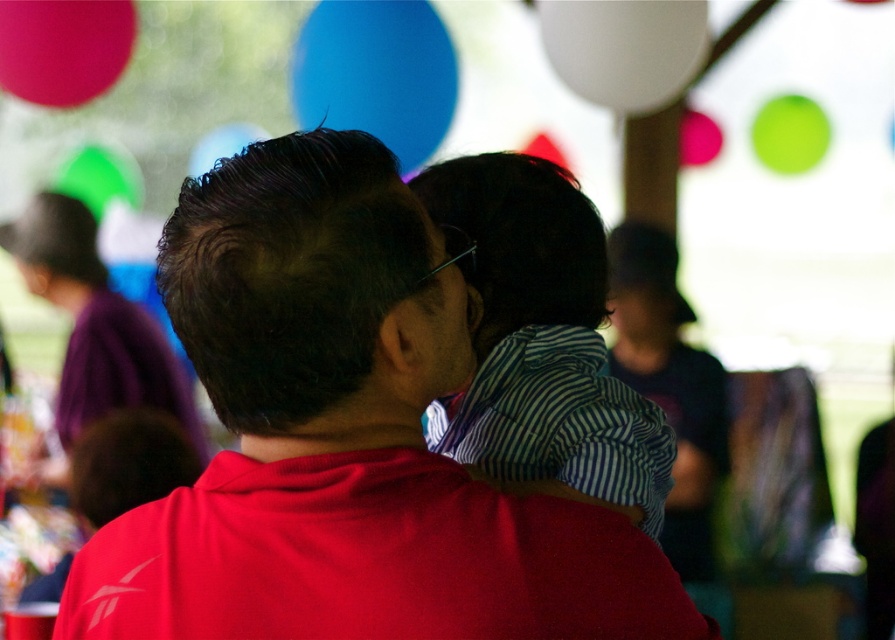
Question: Does white matte balloon at upper center appear on the left side of matte pink balloon at upper right?

Choices:
 (A) yes
 (B) no

Answer: (A)

Question: Among these objects, which one is farthest from the camera?

Choices:
 (A) green matte balloon at upper right
 (B) purple fabric at upper left
 (C) striped fabric shirt at center

Answer: (A)

Question: Where is purple fabric at upper left located in relation to matte pink balloon at upper right in the image?

Choices:
 (A) above
 (B) below

Answer: (B)

Question: Is green matte balloon at upper left further to camera compared to matte pink balloon at upper right?

Choices:
 (A) yes
 (B) no

Answer: (A)

Question: Among these points, which one is farthest from the camera?

Choices:
 (A) (11, 51)
 (B) (61, 173)
 (C) (355, 161)

Answer: (B)

Question: Which point appears farthest from the camera in this image?

Choices:
 (A) (558, 323)
 (B) (651, 67)
 (C) (278, 352)

Answer: (B)